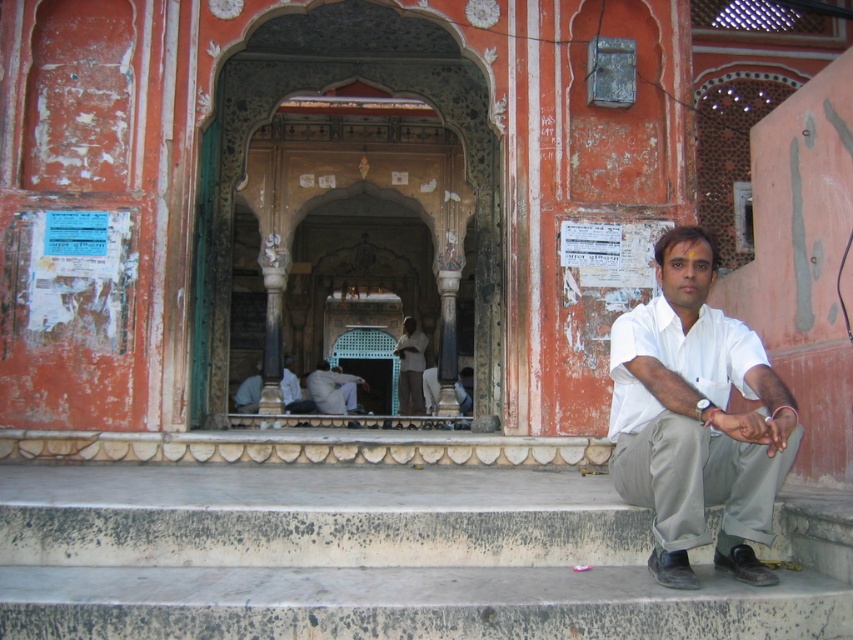
Question: Can you confirm if light brown wooden bench at center is positioned below light gray fabric at center?

Choices:
 (A) no
 (B) yes

Answer: (A)

Question: Which object is positioned farthest from the light brown fabric pants at center?

Choices:
 (A) white matte shirt at lower right
 (B) light gray fabric at center

Answer: (A)

Question: Which of the following is the farthest from the observer?

Choices:
 (A) light brown fabric pants at center
 (B) white matte shirt at lower right
 (C) light gray fabric at center

Answer: (A)

Question: Which point appears closest to the camera in this image?

Choices:
 (A) (236, 400)
 (B) (300, 412)
 (C) (784, 454)

Answer: (C)

Question: Can you confirm if white matte shirt at lower right is thinner than light gray fabric at center?

Choices:
 (A) yes
 (B) no

Answer: (A)

Question: Is light brown fabric pants at center smaller than light gray fabric at center?

Choices:
 (A) yes
 (B) no

Answer: (A)